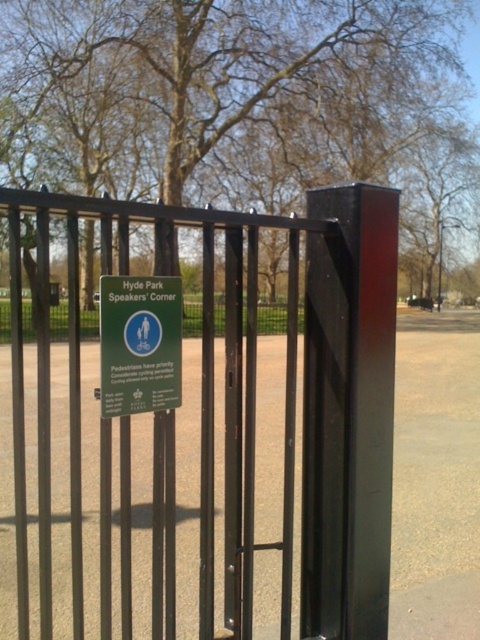
Question: In this image, where is black metal fence at center located relative to green plastic sign at center?

Choices:
 (A) right
 (B) left

Answer: (B)

Question: Which point is farther from the camera taking this photo?

Choices:
 (A) (104, 305)
 (B) (233, 280)

Answer: (B)

Question: Which point appears farthest from the camera in this image?

Choices:
 (A) (122, 273)
 (B) (140, 298)

Answer: (B)

Question: Can you confirm if black metal fence at center is positioned below green plastic sign at center?

Choices:
 (A) no
 (B) yes

Answer: (B)

Question: Which of the following is the farthest from the observer?

Choices:
 (A) black metal fence at center
 (B) green plastic sign at center

Answer: (B)

Question: Does black metal fence at center have a greater width compared to green plastic sign at center?

Choices:
 (A) yes
 (B) no

Answer: (A)